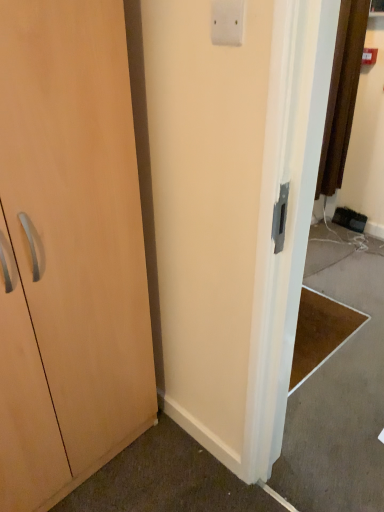
Describe the element at coordinates (68, 251) in the screenshot. I see `light wood cabinet at left` at that location.

This screenshot has height=512, width=384. What are the coordinates of `light wood cabinet at left` in the screenshot? It's located at (68, 251).

In order to face white plastic light switch at upper center, should I rotate leftwards or rightwards?

Rotate right and turn 4.018 degrees.

The height and width of the screenshot is (512, 384). I want to click on white plastic light switch at upper center, so click(x=227, y=22).

Describe the element at coordinates (227, 22) in the screenshot. This screenshot has height=512, width=384. I see `white plastic light switch at upper center` at that location.

In order to click on light wood cabinet at left in this screenshot , I will do coord(68,251).

Based on their positions, is white plastic light switch at upper center located to the left or right of light wood cabinet at left?

Clearly, white plastic light switch at upper center is on the right of light wood cabinet at left in the image.

Is white plastic light switch at upper center positioned before light wood cabinet at left?

That is False.

Is point (238, 25) closer or farther from the camera than point (94, 203)?

Clearly, point (238, 25) is closer to the camera than point (94, 203).

Consider the image. From the image's perspective, which one is positioned lower, white plastic light switch at upper center or light wood cabinet at left?

light wood cabinet at left.

Looking at this image, from a real-world perspective, is white plastic light switch at upper center located beneath light wood cabinet at left?

No, from a real-world perspective, white plastic light switch at upper center is not below light wood cabinet at left.

Does white plastic light switch at upper center have a greater width compared to light wood cabinet at left?

In fact, white plastic light switch at upper center might be narrower than light wood cabinet at left.

Considering the sizes of objects white plastic light switch at upper center and light wood cabinet at left in the image provided, who is shorter, white plastic light switch at upper center or light wood cabinet at left?

With less height is white plastic light switch at upper center.

Considering the sizes of white plastic light switch at upper center and light wood cabinet at left in the image, is white plastic light switch at upper center bigger or smaller than light wood cabinet at left?

Considering their sizes, white plastic light switch at upper center takes up less space than light wood cabinet at left.

Is white plastic light switch at upper center not inside light wood cabinet at left?

Absolutely, white plastic light switch at upper center is external to light wood cabinet at left.

Is white plastic light switch at upper center placed right next to light wood cabinet at left?

No.

Is white plastic light switch at upper center facing towards light wood cabinet at left?

No, white plastic light switch at upper center is not turned towards light wood cabinet at left.

You are a GUI agent. You are given a task and a screenshot of the screen. Output one action in this format:
    pyautogui.click(x=<x>, y=<y>)
    Task: Click on the light switch behind the light wood cabinet at left
    This screenshot has height=512, width=384.
    Given the screenshot: What is the action you would take?
    pyautogui.click(x=227, y=22)

Is light wood cabinet at left to the left or to the right of white plastic light switch at upper center in the image?

light wood cabinet at left is positioned on white plastic light switch at upper center's left side.

Which object is more forward, light wood cabinet at left or white plastic light switch at upper center?

light wood cabinet at left is more forward.

Considering the points (59, 170) and (213, 36), which point is in front, point (59, 170) or point (213, 36)?

The point (213, 36) is in front.

From the image's perspective, is light wood cabinet at left located above white plastic light switch at upper center?

No.

From a real-world perspective, is light wood cabinet at left on white plastic light switch at upper center?

Actually, light wood cabinet at left is physically below white plastic light switch at upper center in the real world.

Considering the sizes of objects light wood cabinet at left and white plastic light switch at upper center in the image provided, who is wider, light wood cabinet at left or white plastic light switch at upper center?

light wood cabinet at left.

Looking at this image, is light wood cabinet at left taller or shorter than white plastic light switch at upper center?

Considering their sizes, light wood cabinet at left has more height than white plastic light switch at upper center.

Between light wood cabinet at left and white plastic light switch at upper center, which one has smaller size?

With smaller size is white plastic light switch at upper center.

In the scene shown: Is light wood cabinet at left located outside white plastic light switch at upper center?

Yes, light wood cabinet at left is outside of white plastic light switch at upper center.

Is light wood cabinet at left with white plastic light switch at upper center?

No, light wood cabinet at left is not in contact with white plastic light switch at upper center.

Is light wood cabinet at left turned away from white plastic light switch at upper center?

No, light wood cabinet at left is not facing the opposite direction of white plastic light switch at upper center.

At what (x,y) coordinates should I click in order to perform the action: click on light switch behind the light wood cabinet at left. Please return your answer as a coordinate pair (x, y). The image size is (384, 512). Looking at the image, I should click on (227, 22).

Where is `light switch above the light wood cabinet at left (from a real-world perspective)`? light switch above the light wood cabinet at left (from a real-world perspective) is located at coordinates (227, 22).

Image resolution: width=384 pixels, height=512 pixels. I want to click on light switch on the right of the light wood cabinet at left, so click(x=227, y=22).